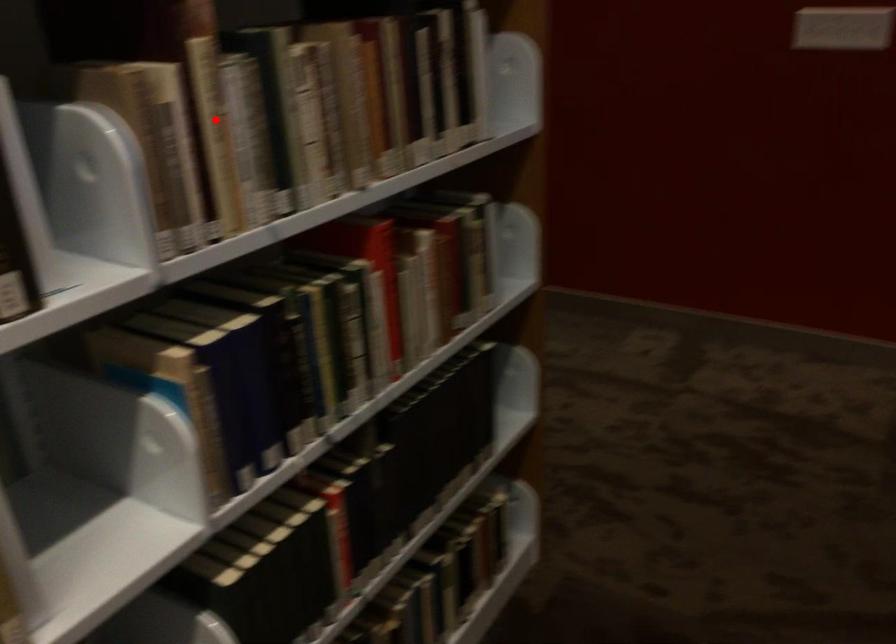
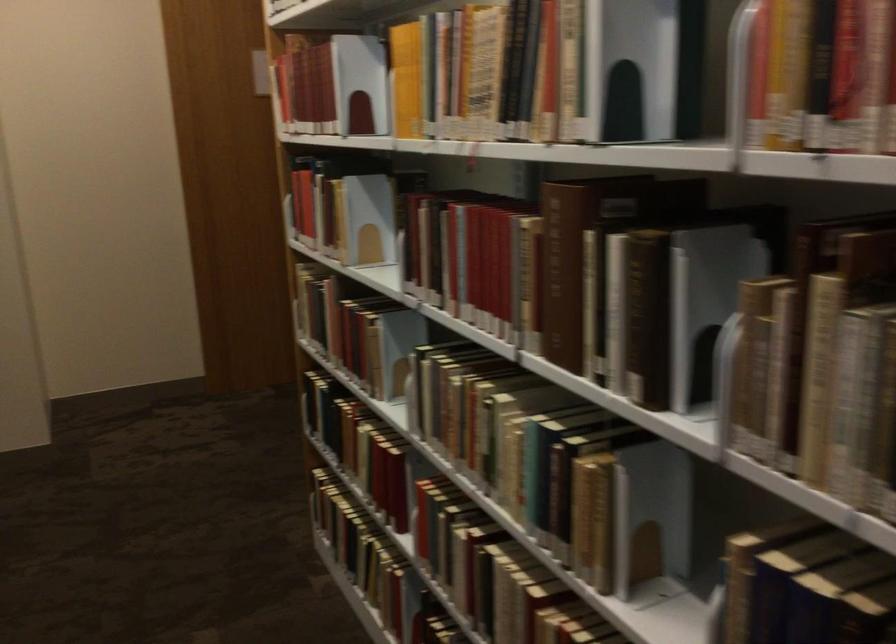
Question: I am providing you with two images of the same scene from different viewpoints. Given a red point in image1, look at the same physical point in image2. Is it:

Choices:
 (A) Closer to the viewpoint
 (B) Farther from the viewpoint

Answer: (A)